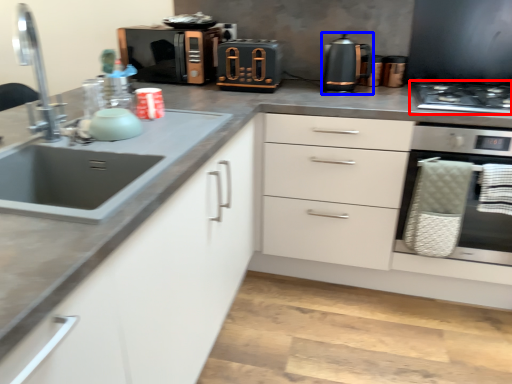
Question: Which of the following is the farthest to the observer, gas stove (highlighted by a red box) or kitchen appliance (highlighted by a blue box)?

Choices:
 (A) gas stove
 (B) kitchen appliance

Answer: (B)